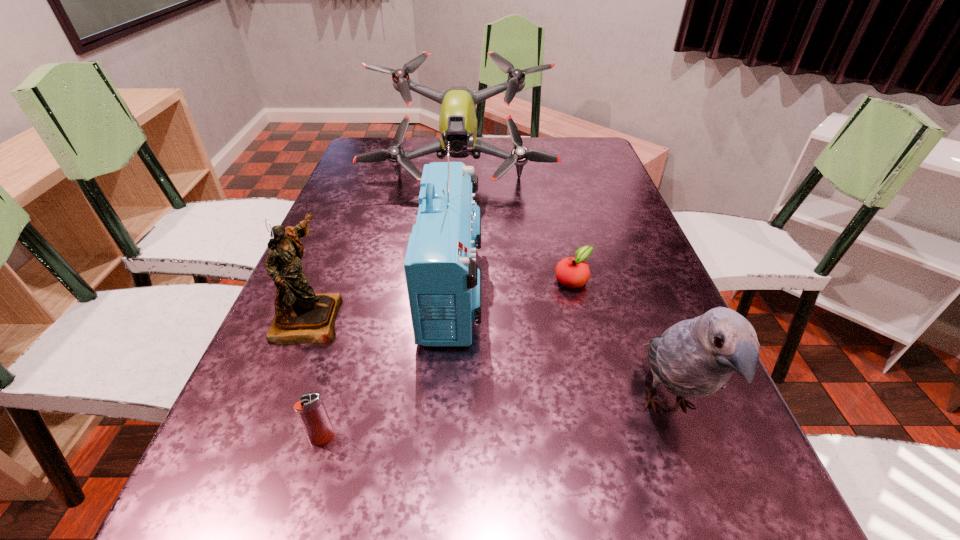
Find the location of a particular element. vacant space in between the rightmost object and the radio receiver is located at coordinates (561, 347).

Where is `free space between the second shortest object and the rightmost object`? The image size is (960, 540). free space between the second shortest object and the rightmost object is located at coordinates (495, 422).

Choose which object is the second nearest neighbor to the farthest object. Please provide its 2D coordinates. Your answer should be formatted as a tuple, i.e. [(x, y)], where the tuple contains the x and y coordinates of a point satisfying the conditions above.

[(573, 272)]

Identify the location of object that is the nearest to the parrot. This screenshot has height=540, width=960. (573, 272).

Find the location of a particular element. This screenshot has height=540, width=960. free spot that satisfies the following two spatial constraints: 1. on the back side of the fifth tallest object; 2. on the left side of the shortest object is located at coordinates (369, 280).

Find the location of `blank area in the image that satisfies the following two spatial constraints: 1. on the front-facing side of the farthest object; 2. on the front-facing side of the figurine`. blank area in the image that satisfies the following two spatial constraints: 1. on the front-facing side of the farthest object; 2. on the front-facing side of the figurine is located at coordinates (449, 317).

This screenshot has width=960, height=540. I want to click on blank area in the image that satisfies the following two spatial constraints: 1. on the front-facing side of the shortest object; 2. on the left side of the farthest object, so click(x=452, y=280).

Where is `free region that satisfies the following two spatial constraints: 1. on the front-facing side of the fifth tallest object; 2. on the right side of the figurine`? This screenshot has width=960, height=540. free region that satisfies the following two spatial constraints: 1. on the front-facing side of the fifth tallest object; 2. on the right side of the figurine is located at coordinates (260, 438).

Locate an element on the screen. This screenshot has height=540, width=960. free location that satisfies the following two spatial constraints: 1. on the front-facing side of the drone; 2. on the right side of the apple is located at coordinates (452, 280).

Where is `free space that satisfies the following two spatial constraints: 1. on the front-facing side of the second shortest object; 2. on the left side of the figurine`? The width and height of the screenshot is (960, 540). free space that satisfies the following two spatial constraints: 1. on the front-facing side of the second shortest object; 2. on the left side of the figurine is located at coordinates (260, 438).